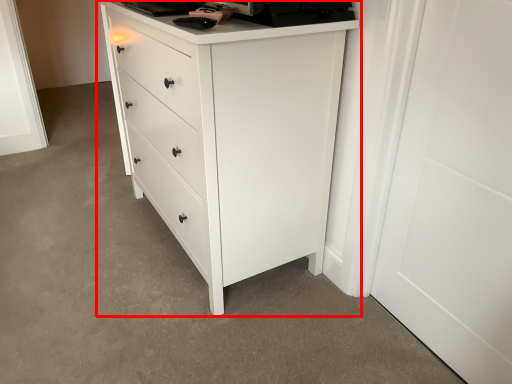
Question: From the image's perspective, where is chest of drawers (annotated by the red box) located relative to door?

Choices:
 (A) below
 (B) above

Answer: (B)